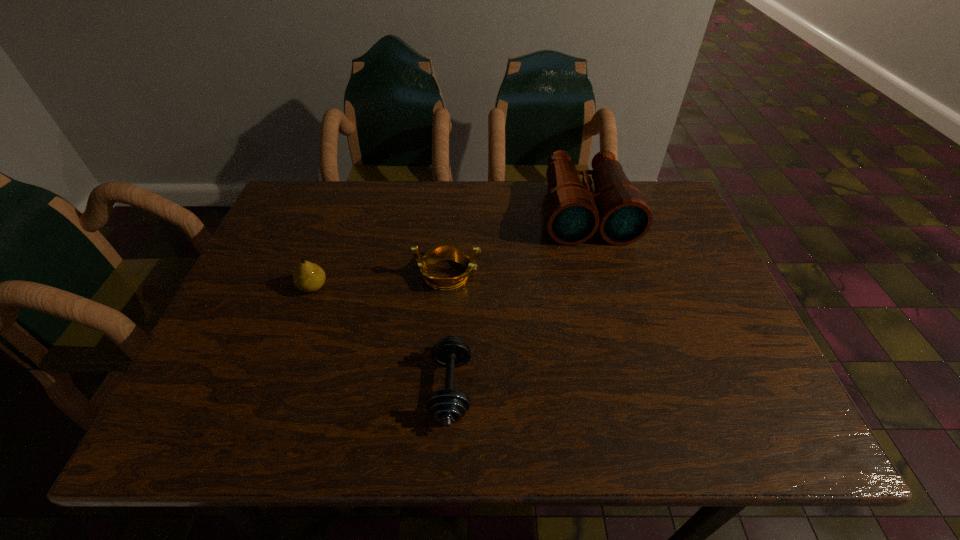
In order to click on the tallest object in this screenshot , I will do `click(573, 213)`.

Where is `the farthest object`? the farthest object is located at coordinates (573, 213).

At what (x,y) coordinates should I click in order to perform the action: click on pear. Please return your answer as a coordinate pair (x, y). Image resolution: width=960 pixels, height=540 pixels. Looking at the image, I should click on (308, 277).

Locate an element on the screen. tiara is located at coordinates (445, 250).

Where is `the shortest object`? Image resolution: width=960 pixels, height=540 pixels. the shortest object is located at coordinates (448, 406).

This screenshot has width=960, height=540. I want to click on dumbbell, so click(x=448, y=406).

At what (x,y) coordinates should I click in order to perform the action: click on free location located through the lenses of the tallest object. Please return your answer as a coordinate pair (x, y). This screenshot has width=960, height=540. Looking at the image, I should click on (626, 363).

Locate an element on the screen. This screenshot has height=540, width=960. vacant space located 0.230m on the front of the pear is located at coordinates (277, 386).

The height and width of the screenshot is (540, 960). I want to click on vacant space located at the front emblem of the tiara, so click(x=590, y=274).

Where is `vacant space situated 0.230m on the back of the dumbbell`? vacant space situated 0.230m on the back of the dumbbell is located at coordinates (457, 271).